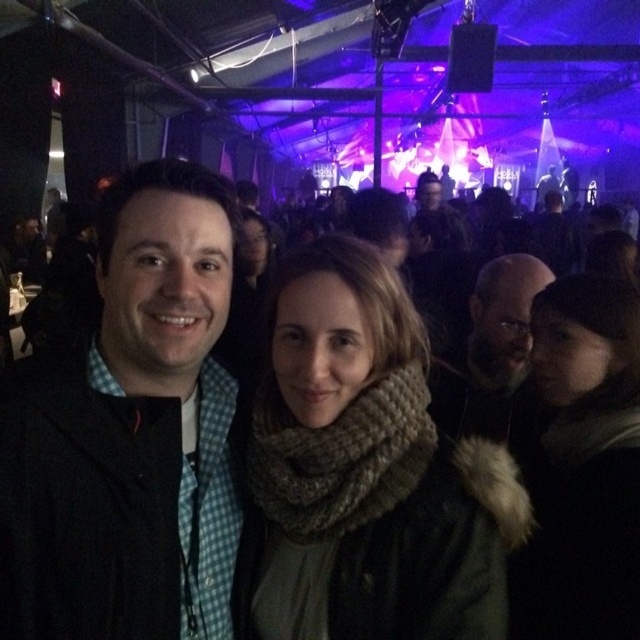
You are standing at the entrance of the event and want to take a photo of the knitted beige scarf at center and the knitted scarf at center. Which one should you focus on first to ensure it appears sharp in the photo?

The knitted beige scarf at center should be focused on first because it is in front of the knitted scarf at center, so focusing on it will keep both in focus if they are in the same plane. However, if depth of field is limited, prioritizing the front one ensures it is sharp.

In the scene shown: You are standing at the entrance of the tent and want to take a photo of the knitted beige scarf at center. Which direction should you move to get a clear view of it?

The knitted beige scarf at center is located at point (369, 468), so you should move towards the center of the tent to get a clear view of it.